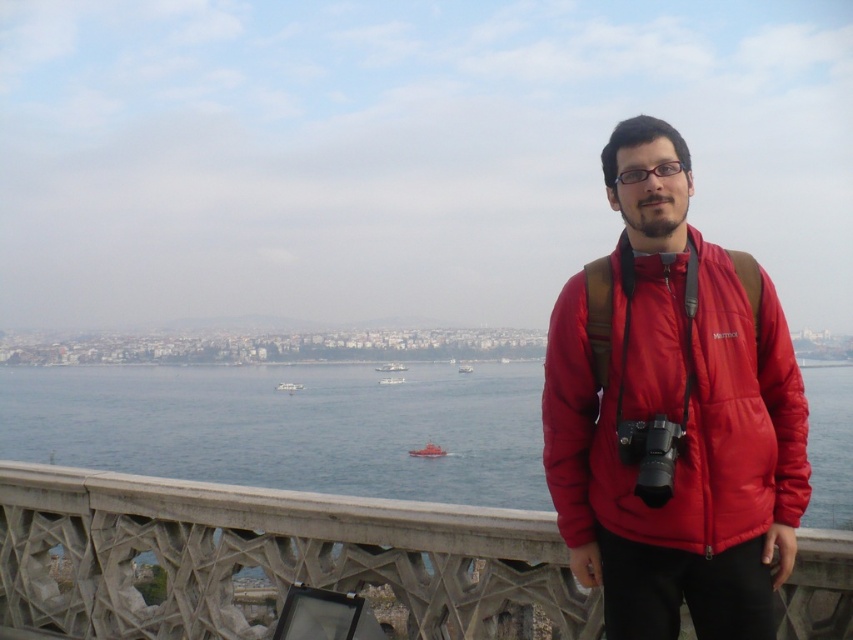
Does concrete textured rail at lower center lie behind metallic silver boat at center?

No.

Is concrete textured rail at lower center taller than metallic silver boat at center?

Yes.

Between point (9, 513) and point (416, 449), which one is positioned in front?

Point (9, 513) is more forward.

Find the location of a particular element. concrete textured rail at lower center is located at coordinates (267, 557).

Is glossy plastic glasses at center taller than white matte boat at center?

No, glossy plastic glasses at center is not taller than white matte boat at center.

Does glossy plastic glasses at center appear over white matte boat at center?

Correct, glossy plastic glasses at center is located above white matte boat at center.

The height and width of the screenshot is (640, 853). What are the coordinates of `glossy plastic glasses at center` in the screenshot? It's located at (648, 172).

Does blue water at center appear on the right side of white matte boat at center?

Indeed, blue water at center is positioned on the right side of white matte boat at center.

Can you confirm if blue water at center is positioned to the left of white matte boat at center?

No, blue water at center is not to the left of white matte boat at center.

The width and height of the screenshot is (853, 640). Identify the location of blue water at center. (289, 428).

What are the coordinates of `blue water at center` in the screenshot? It's located at (x=289, y=428).